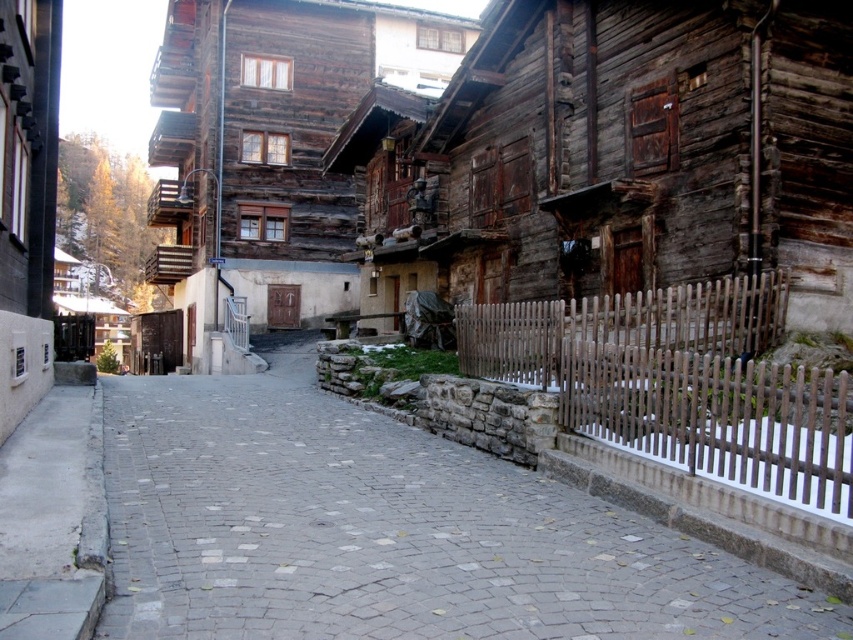
Between brown wooden fence at lower right and gray concrete sidewalk at lower left, which one appears on the right side from the viewer's perspective?

Positioned to the right is brown wooden fence at lower right.

Does brown wooden fence at lower right have a smaller size compared to gray concrete sidewalk at lower left?

No, brown wooden fence at lower right is not smaller than gray concrete sidewalk at lower left.

Between point (757, 360) and point (85, 481), which one is positioned behind?

Point (757, 360)

Where is `brown wooden fence at lower right`? brown wooden fence at lower right is located at coordinates (679, 381).

Looking at this image, which is more to the right, gray cobblestone path at center or gray concrete sidewalk at lower left?

gray cobblestone path at center is more to the right.

Is point (268, 620) closer to camera compared to point (38, 458)?

Yes, point (268, 620) is closer to viewer.

Who is more forward, (151, 605) or (26, 625)?

Point (26, 625) is more forward.

Identify the location of gray cobblestone path at center. (387, 531).

Can you confirm if gray cobblestone path at center is taller than brown wooden fence at lower right?

Incorrect, gray cobblestone path at center's height is not larger of brown wooden fence at lower right's.

Looking at this image, is gray cobblestone path at center above brown wooden fence at lower right?

Incorrect, gray cobblestone path at center is not positioned above brown wooden fence at lower right.

You are a GUI agent. You are given a task and a screenshot of the screen. Output one action in this format:
    pyautogui.click(x=<x>, y=<y>)
    Task: Click on the gray cobblestone path at center
    The width and height of the screenshot is (853, 640).
    Given the screenshot: What is the action you would take?
    pyautogui.click(x=387, y=531)